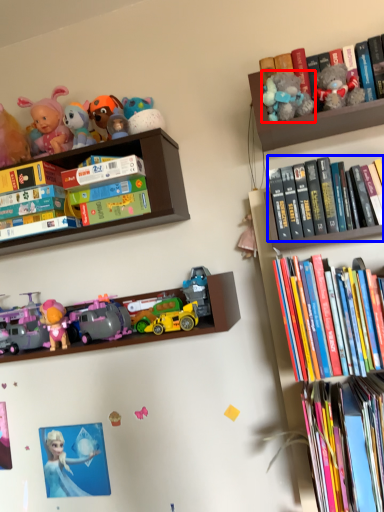
Question: Which point is closer to the camera, toy (highlighted by a red box) or book (highlighted by a blue box)?

Choices:
 (A) toy
 (B) book

Answer: (A)